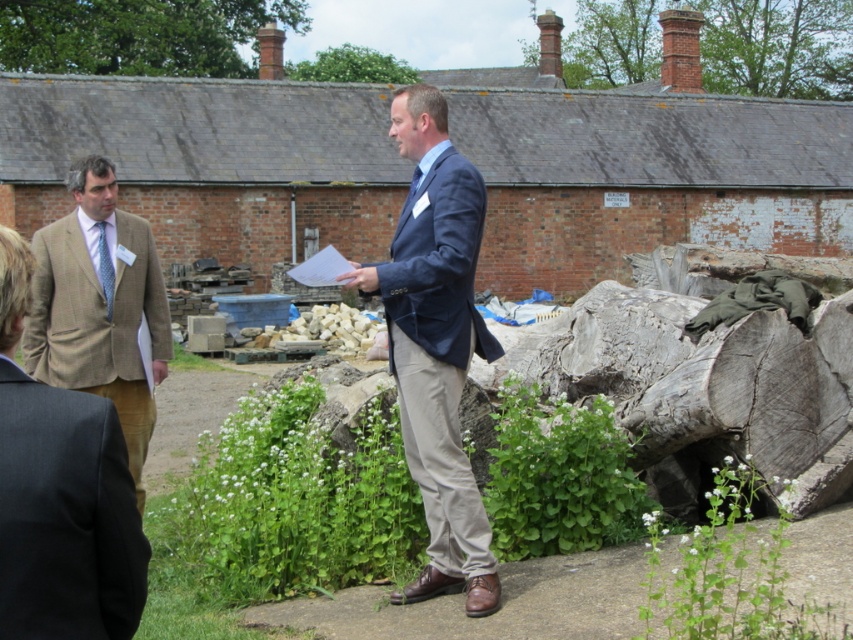
Based on the scene description, where is the velvet blue blazer at center located in relation to the large brick building in the background?

The velvet blue blazer at center is positioned in the foreground, closer to the viewer than the large brick building in the background.

You are an observer standing in front of the brick building and see the two people wearing brown tweed blazer at left and brown tweed suit at left. Which one is more to the left?

The brown tweed suit at left is more to the left because the brown tweed blazer at left is positioned on the right side of it.